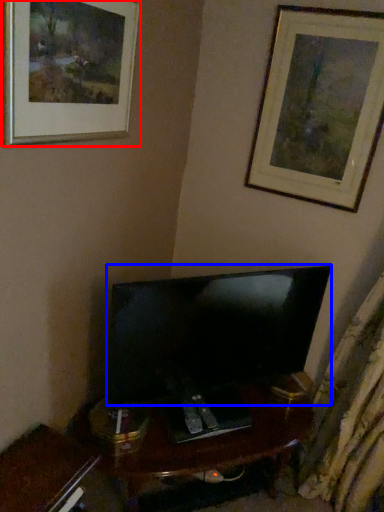
Question: Which object is closer to the camera taking this photo, picture frame (highlighted by a red box) or television (highlighted by a blue box)?

Choices:
 (A) picture frame
 (B) television

Answer: (A)